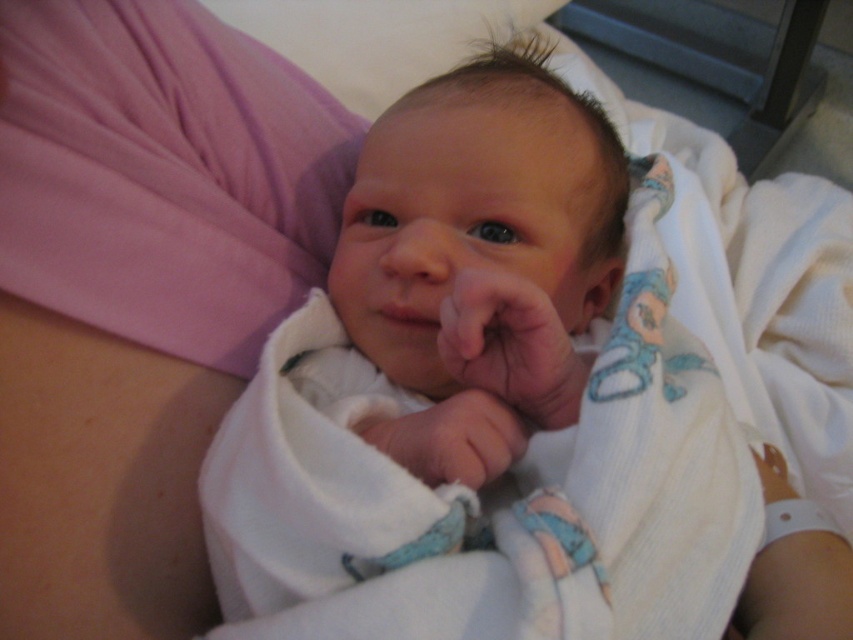
Question: Estimate the real-world distances between objects in this image. Which object is closer to the white soft swaddle at center?

Choices:
 (A) smooth skin hand at center
 (B) white soft fabric hand at center

Answer: (A)

Question: Does smooth skin hand at center have a greater width compared to white soft fabric hand at center?

Choices:
 (A) no
 (B) yes

Answer: (A)

Question: Can you confirm if white soft swaddle at center is positioned to the left of white soft fabric hand at center?

Choices:
 (A) yes
 (B) no

Answer: (B)

Question: Is smooth skin hand at center below white soft fabric hand at center?

Choices:
 (A) yes
 (B) no

Answer: (B)

Question: Among these objects, which one is farthest from the camera?

Choices:
 (A) white soft swaddle at center
 (B) white soft fabric hand at center
 (C) smooth skin hand at center

Answer: (B)

Question: Which object appears closest to the camera in this image?

Choices:
 (A) white soft fabric hand at center
 (B) smooth skin hand at center

Answer: (B)